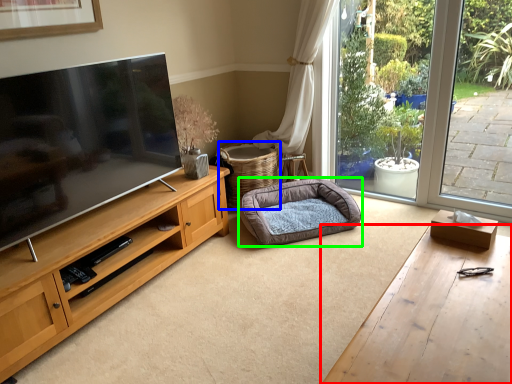
Question: Which object is the farthest from desk (highlighted by a red box)? Choose among these: basket (highlighted by a blue box) or dog bed (highlighted by a green box).

Choices:
 (A) basket
 (B) dog bed

Answer: (A)